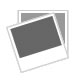
At what (x,y) coordinates should I click in order to perform the action: click on corners of pictures. Please return your answer as a coordinate pair (x, y). The height and width of the screenshot is (80, 80). Looking at the image, I should click on [21, 71], [67, 57], [53, 14], [6, 27], [68, 10], [18, 10], [68, 57].